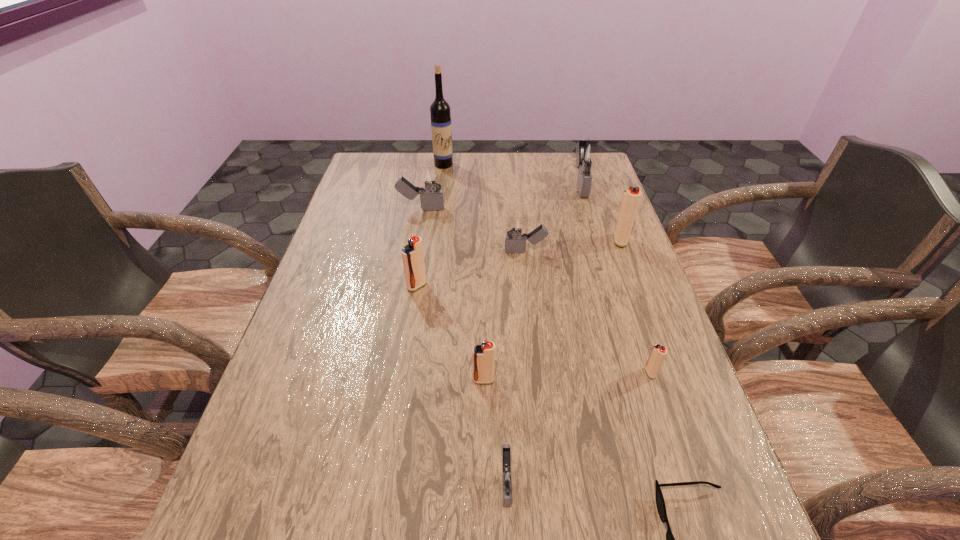
Identify the location of the tallest object. (441, 128).

Where is `black wine bottle`? This screenshot has height=540, width=960. black wine bottle is located at coordinates (441, 128).

Find the location of a particular element. Image resolution: width=960 pixels, height=540 pixels. the rightmost red igniter is located at coordinates tap(631, 197).

The image size is (960, 540). I want to click on the farthest red igniter, so click(631, 197).

You are a GUI agent. You are given a task and a screenshot of the screen. Output one action in this format:
    pyautogui.click(x=<x>, y=<y>)
    Task: Click on the rightmost gray igniter
    Image resolution: width=960 pixels, height=540 pixels.
    Given the screenshot: What is the action you would take?
    tap(588, 154)

Find the location of a particular element. The width and height of the screenshot is (960, 540). the farthest igniter is located at coordinates (588, 154).

Locate an element on the screen. The width and height of the screenshot is (960, 540). the third nearest red igniter is located at coordinates pos(412,254).

Where is `the fifth nearest object`? The image size is (960, 540). the fifth nearest object is located at coordinates (412, 254).

At what (x,y) coordinates should I click in order to perform the action: click on the third farthest object. Please return your answer as a coordinate pair (x, y). Image resolution: width=960 pixels, height=540 pixels. Looking at the image, I should click on (430, 178).

Identify the location of the third nearest gray igniter. (430, 178).